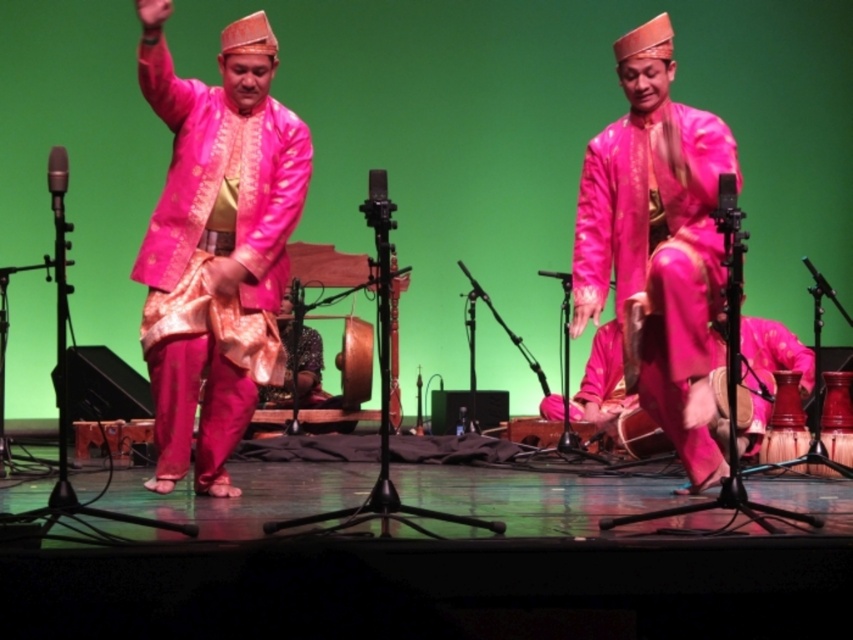
Which is below, matte pink silk outfit at center or silky pink fabric at center?

Positioned lower is silky pink fabric at center.

Between matte pink silk outfit at center and silky pink fabric at center, which one has more height?

matte pink silk outfit at center is taller.

Where is `matte pink silk outfit at center`? The image size is (853, 640). matte pink silk outfit at center is located at coordinates (213, 241).

Who is lower down, matte pink silk outfit at center or matte pink fabric at center?

matte pink fabric at center

Which is behind, point (213, 179) or point (637, 76)?

The point (637, 76) is more distant.

Which is behind, point (183, 172) or point (611, 257)?

The point (611, 257) is more distant.

This screenshot has height=640, width=853. I want to click on matte pink silk outfit at center, so click(x=213, y=241).

Is matte pink fabric at center closer to camera compared to silky pink fabric at center?

Yes, it is.

What do you see at coordinates (657, 243) in the screenshot? I see `matte pink fabric at center` at bounding box center [657, 243].

Where is `matte pink fabric at center`? The height and width of the screenshot is (640, 853). matte pink fabric at center is located at coordinates (657, 243).